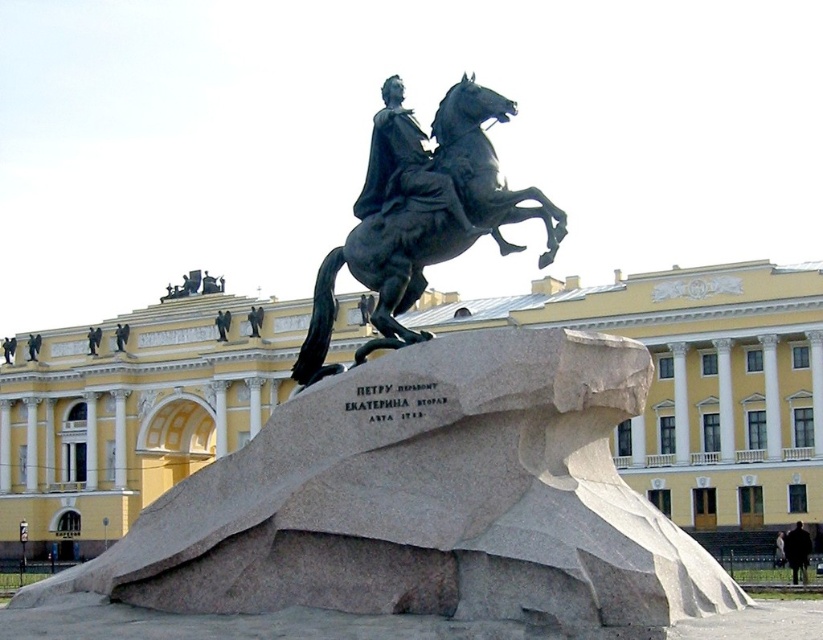
Between point (321, 312) and point (417, 195), which one is positioned in front?

Point (417, 195)

Is polished bronze horse at center further to camera compared to polished bronze statue at center?

No, polished bronze horse at center is closer to the viewer.

Identify the location of polished bronze horse at center. (380, 275).